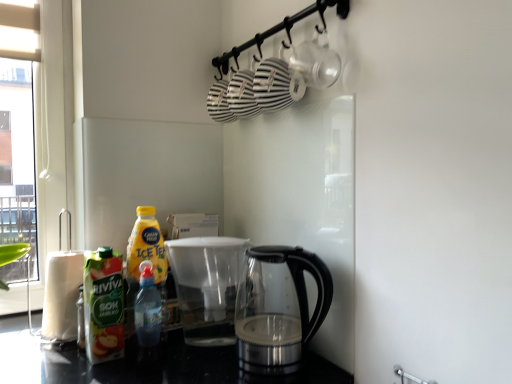
Question: Are white paper towel at left and translucent plastic bottle at lower left, positioned as the 2th bottle in left-to-right order, located far from each other?

Choices:
 (A) no
 (B) yes

Answer: (A)

Question: Does white paper towel at left turn towards translucent plastic bottle at lower left, positioned as the 2th bottle in left-to-right order?

Choices:
 (A) no
 (B) yes

Answer: (A)

Question: Is white paper towel at left turned away from translucent plastic bottle at lower left, which appears as the first bottle when viewed from the right?

Choices:
 (A) no
 (B) yes

Answer: (A)

Question: From a real-world perspective, does white paper towel at left stand above translucent plastic bottle at lower left, which appears as the first bottle when viewed from the right?

Choices:
 (A) yes
 (B) no

Answer: (A)

Question: Is white paper towel at left taller than translucent plastic bottle at lower left, positioned as the 2th bottle in left-to-right order?

Choices:
 (A) yes
 (B) no

Answer: (A)

Question: Considering the relative positions of transparent glass kettle at lower center and green matte juice at left, which is the 2th bottle from right to left, in the image provided, is transparent glass kettle at lower center to the left or to the right of green matte juice at left, which is the 2th bottle from right to left,?

Choices:
 (A) left
 (B) right

Answer: (B)

Question: Considering the positions of transparent glass kettle at lower center and green matte juice at left, which is the 2th bottle from right to left, in the image, is transparent glass kettle at lower center bigger or smaller than green matte juice at left, which is the 2th bottle from right to left,?

Choices:
 (A) big
 (B) small

Answer: (A)

Question: From the image's perspective, is transparent glass kettle at lower center positioned above or below green matte juice at left, the 1th bottle viewed from the left?

Choices:
 (A) above
 (B) below

Answer: (B)

Question: In the image, is transparent glass kettle at lower center positioned in front of or behind green matte juice at left, the 1th bottle viewed from the left?

Choices:
 (A) front
 (B) behind

Answer: (A)

Question: Considering their positions, is green matte juice at left, which is the 2th bottle from right to left, located in front of or behind white paper towel at left?

Choices:
 (A) behind
 (B) front

Answer: (B)

Question: Considering the positions of green matte juice at left, which is the 2th bottle from right to left, and white paper towel at left in the image, is green matte juice at left, which is the 2th bottle from right to left, bigger or smaller than white paper towel at left?

Choices:
 (A) small
 (B) big

Answer: (A)

Question: From a real-world perspective, is green matte juice at left, the 1th bottle viewed from the left, physically located above or below white paper towel at left?

Choices:
 (A) above
 (B) below

Answer: (A)

Question: In terms of height, does green matte juice at left, the 1th bottle viewed from the left, look taller or shorter compared to white paper towel at left?

Choices:
 (A) tall
 (B) short

Answer: (A)

Question: From a real-world perspective, relative to green matte juice at left, the 1th bottle viewed from the left, is translucent plastic bottle at lower left, which appears as the first bottle when viewed from the right, vertically above or below?

Choices:
 (A) above
 (B) below

Answer: (B)

Question: From their relative heights in the image, would you say translucent plastic bottle at lower left, positioned as the 2th bottle in left-to-right order, is taller or shorter than green matte juice at left, the 1th bottle viewed from the left?

Choices:
 (A) short
 (B) tall

Answer: (A)